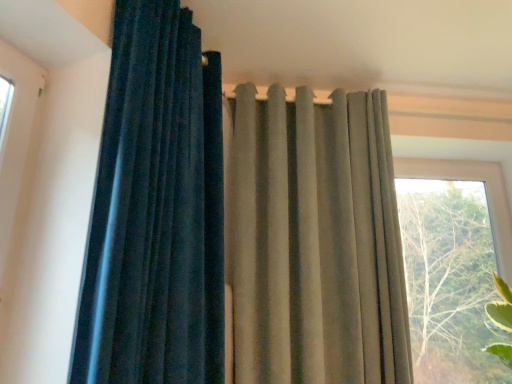
Question: From the image's perspective, is velvet dark blue curtain at left, acting as the first curtain starting from the left, located above or below transparent glass window at right?

Choices:
 (A) above
 (B) below

Answer: (A)

Question: From a real-world perspective, is velvet dark blue curtain at left, acting as the first curtain starting from the left, positioned above or below transparent glass window at right?

Choices:
 (A) below
 (B) above

Answer: (B)

Question: Which object is positioned farthest from the satin beige curtain at upper center, which is the 1th curtain in right-to-left order?

Choices:
 (A) transparent glass window at right
 (B) velvet dark blue curtain at left, acting as the first curtain starting from the left

Answer: (A)

Question: Based on their relative distances, which object is farther from the satin beige curtain at upper center, which is the 1th curtain in right-to-left order?

Choices:
 (A) velvet dark blue curtain at left, acting as the first curtain starting from the left
 (B) transparent glass window at right

Answer: (B)